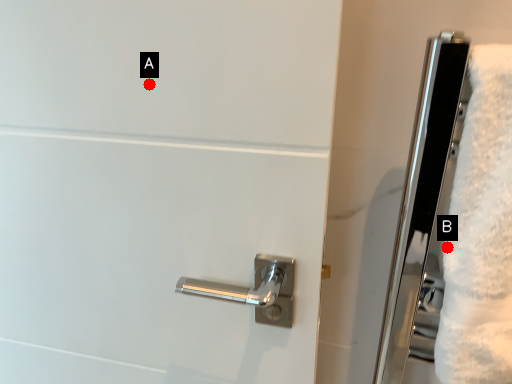
Question: Two points are circled on the image, labeled by A and B beside each circle. Which of the following is the farthest from the observer?

Choices:
 (A) A is further
 (B) B is further

Answer: (B)